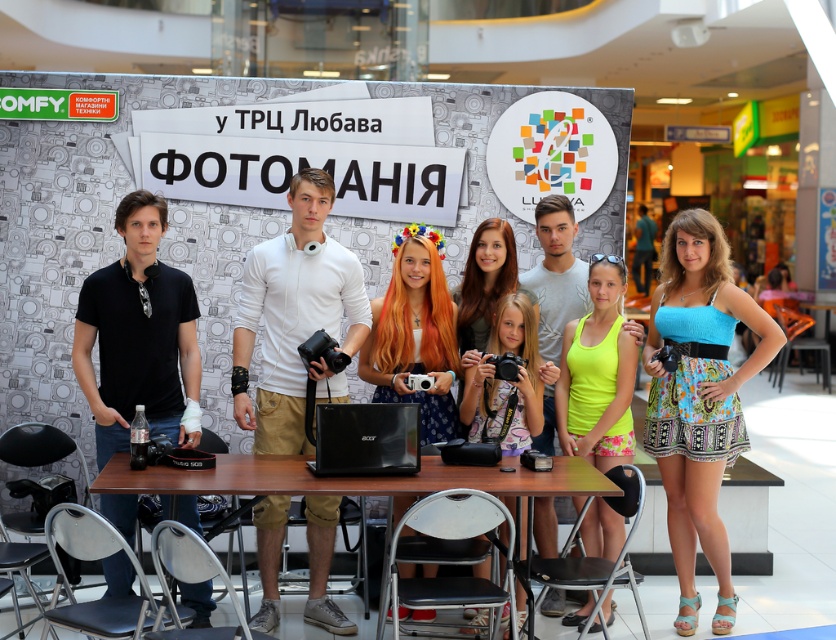
From the picture: You are a photographer at the FOTOMANIA event at TRC Lyubava. You need to locate the neon yellow tank top at center to capture a closeup shot. According to the coordinates provided, where exactly should you focus your camera?

The neon yellow tank top at center is located at point (599, 372).

You are a photographer at the event and need to adjust the lighting. The blue printed dress at center is blocking the light. Can you move the brown wooden table at center to make space?

A: The blue printed dress at center is larger in size than the brown wooden table at center, so moving the brown wooden table at center might be easier since it is smaller. However, the dress is an object worn by a person, so you should ask the person wearing the blue printed dress at center to move instead of moving the table.